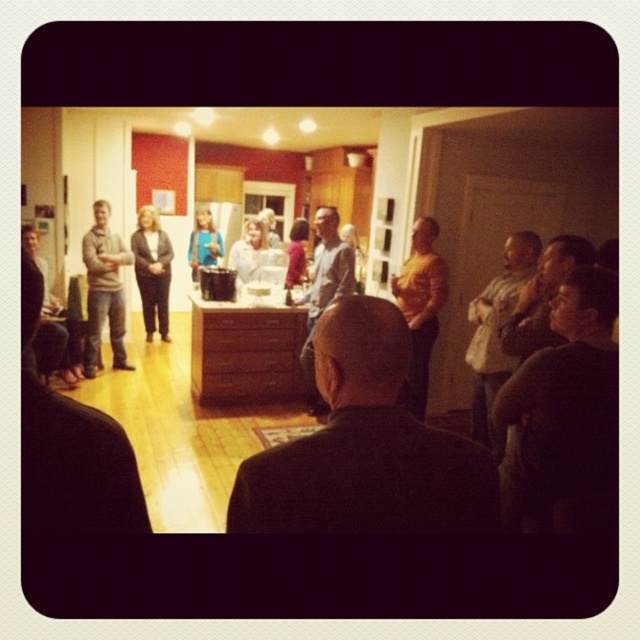
You are at a social gathering and see two people wearing an orange shirt at center and a white shirt at center. Which one is positioned lower in the image?

The orange shirt at center is located below the white shirt at center, so the orange shirt at center is positioned lower in the image.